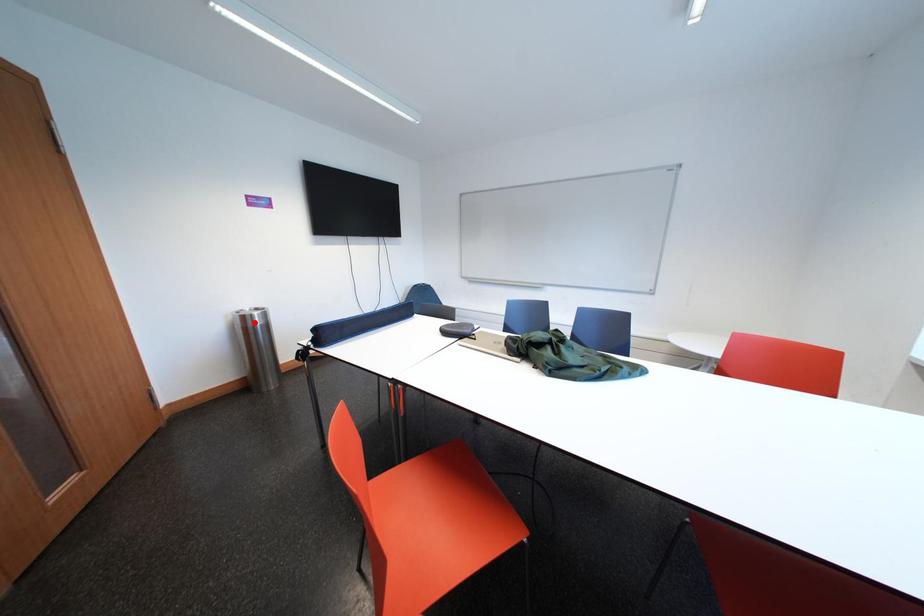
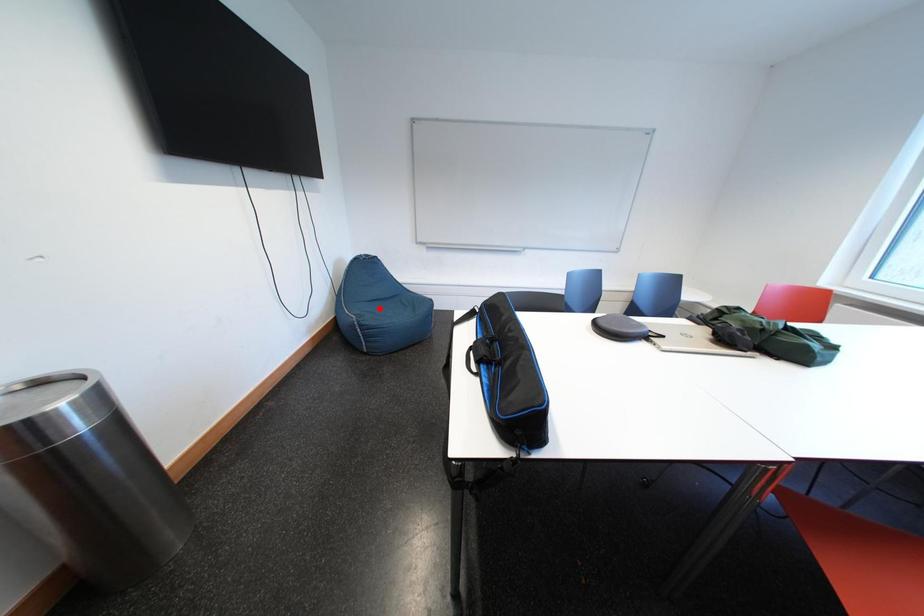
I am providing you with two images of the same scene from different viewpoints. A red point is marked on the first image and another point is marked on the second image. Is the marked point in image1 the same physical position as the marked point in image2?

No